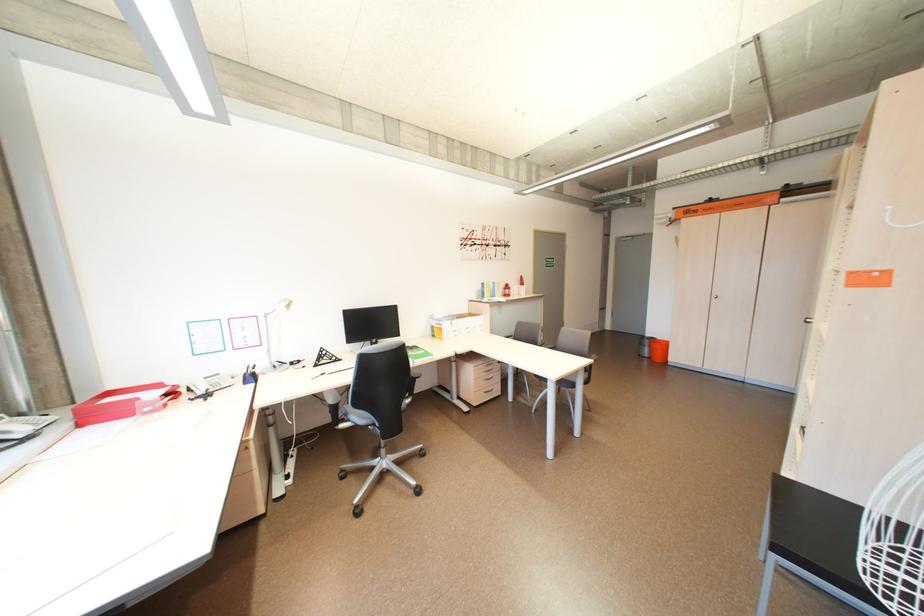
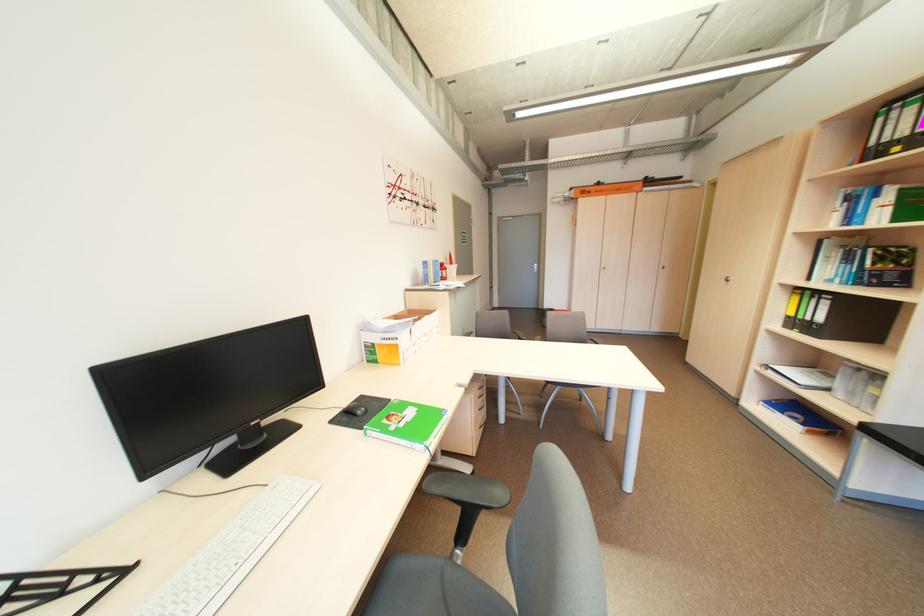
Where in the second image is the point corresponding to [450,330] from the first image?

(406, 347)